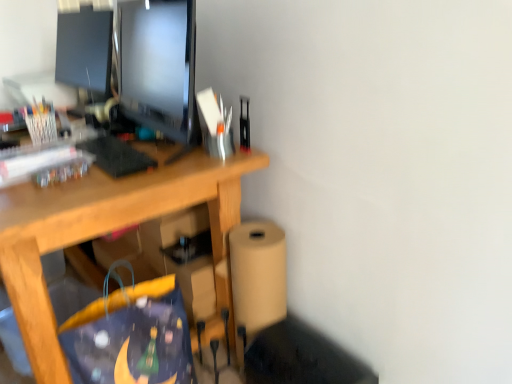
Question: Does metallic silver stapler at upper right, the first stationery positioned from the right, come behind matte black monitor at upper left?

Choices:
 (A) yes
 (B) no

Answer: (A)

Question: Does metallic silver stapler at upper right, which is the second stationery from left to right, have a larger size compared to matte black monitor at upper left?

Choices:
 (A) no
 (B) yes

Answer: (A)

Question: Would you say metallic silver stapler at upper right, positioned as the first stationery in front-to-back order, is outside matte black monitor at upper left?

Choices:
 (A) yes
 (B) no

Answer: (A)

Question: Can you confirm if metallic silver stapler at upper right, the first stationery positioned from the right, is shorter than matte black monitor at upper left?

Choices:
 (A) no
 (B) yes

Answer: (B)

Question: Is metallic silver stapler at upper right, which is the second stationery from left to right, not close to matte black monitor at upper left?

Choices:
 (A) no
 (B) yes

Answer: (A)

Question: Is blue fabric shopping bag at lower center wider or thinner than matte black monitor at upper left?

Choices:
 (A) thin
 (B) wide

Answer: (B)

Question: Looking at the image, does blue fabric shopping bag at lower center seem bigger or smaller compared to matte black monitor at upper left?

Choices:
 (A) small
 (B) big

Answer: (B)

Question: Considering the positions of point (76, 354) and point (118, 79), is point (76, 354) closer or farther from the camera than point (118, 79)?

Choices:
 (A) closer
 (B) farther

Answer: (A)

Question: Relative to matte black monitor at upper left, is blue fabric shopping bag at lower center in front or behind?

Choices:
 (A) behind
 (B) front

Answer: (B)

Question: In the image, is matte black monitor at upper left positioned in front of or behind blue fabric shopping bag at lower center?

Choices:
 (A) behind
 (B) front

Answer: (A)

Question: From the image's perspective, is matte black monitor at upper left located above or below blue fabric shopping bag at lower center?

Choices:
 (A) above
 (B) below

Answer: (A)

Question: Considering the positions of matte black monitor at upper left and blue fabric shopping bag at lower center in the image, is matte black monitor at upper left bigger or smaller than blue fabric shopping bag at lower center?

Choices:
 (A) small
 (B) big

Answer: (A)

Question: Is point (174, 46) positioned closer to the camera than point (134, 322)?

Choices:
 (A) farther
 (B) closer

Answer: (B)

Question: Is point (186, 354) closer or farther from the camera than point (241, 148)?

Choices:
 (A) farther
 (B) closer

Answer: (B)

Question: Considering the positions of blue fabric shopping bag at lower center and metallic silver stapler at upper right, which is the second stationery from left to right, in the image, is blue fabric shopping bag at lower center wider or thinner than metallic silver stapler at upper right, which is the second stationery from left to right,?

Choices:
 (A) thin
 (B) wide

Answer: (B)